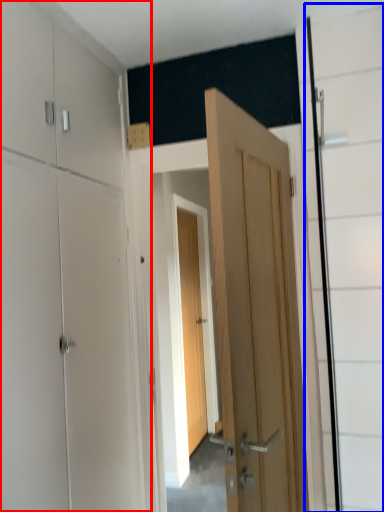
Question: Which of the following is the closest to the observer, dresser (highlighted by a red box) or glass door (highlighted by a blue box)?

Choices:
 (A) dresser
 (B) glass door

Answer: (A)